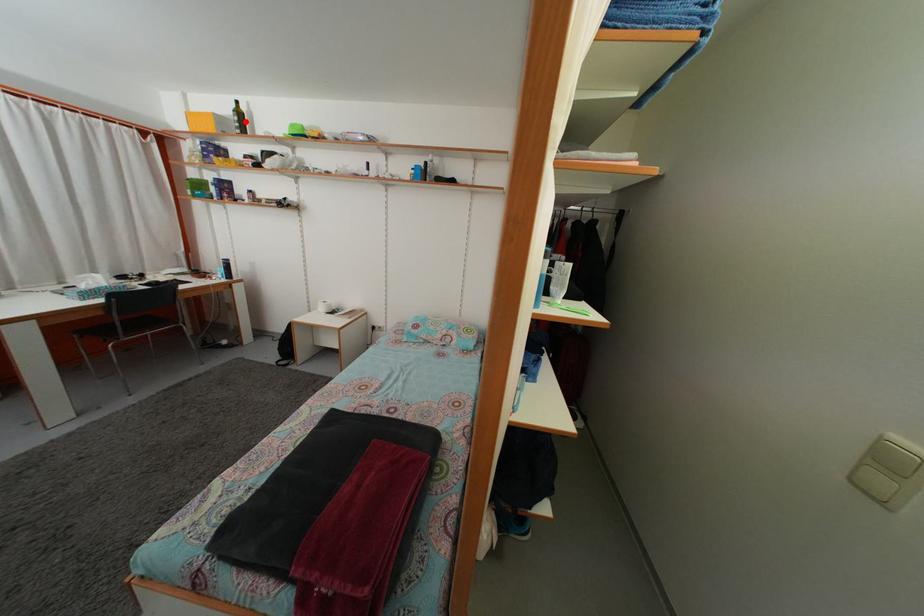
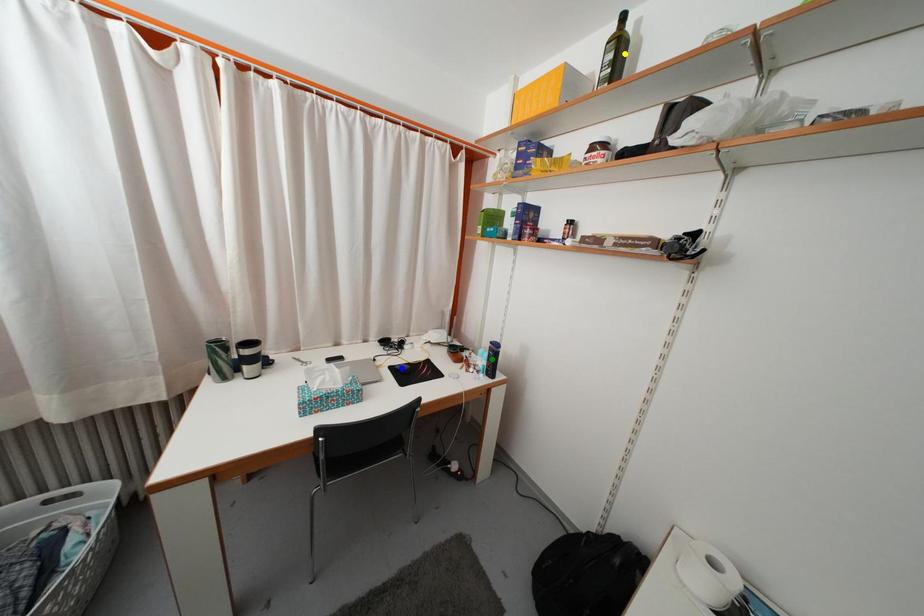
Question: I am providing you with two images of the same scene from different viewpoints. A red point is marked on the first image. You are given multiple points on the second image. Which mark in image 2 goes with the point in image 1?

Choices:
 (A) blue point
 (B) yellow point
 (C) green point

Answer: (B)